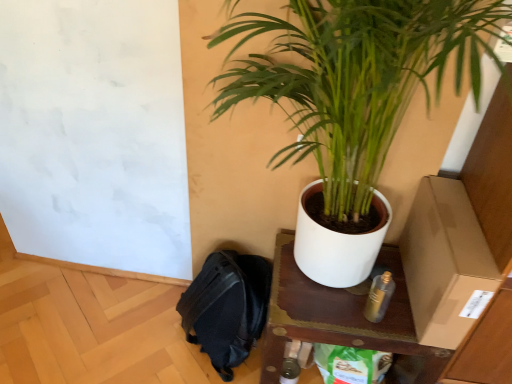
In order to click on free location to the right of metallic gold spray can at lower right in this screenshot , I will do `click(403, 324)`.